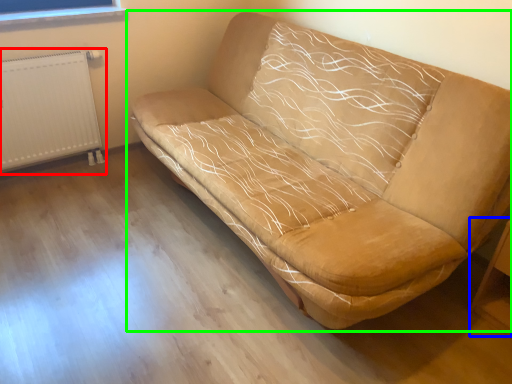
Question: Considering the real-world distances, which object is farthest from radiator (highlighted by a red box)? table (highlighted by a blue box) or studio couch (highlighted by a green box)?

Choices:
 (A) table
 (B) studio couch

Answer: (A)